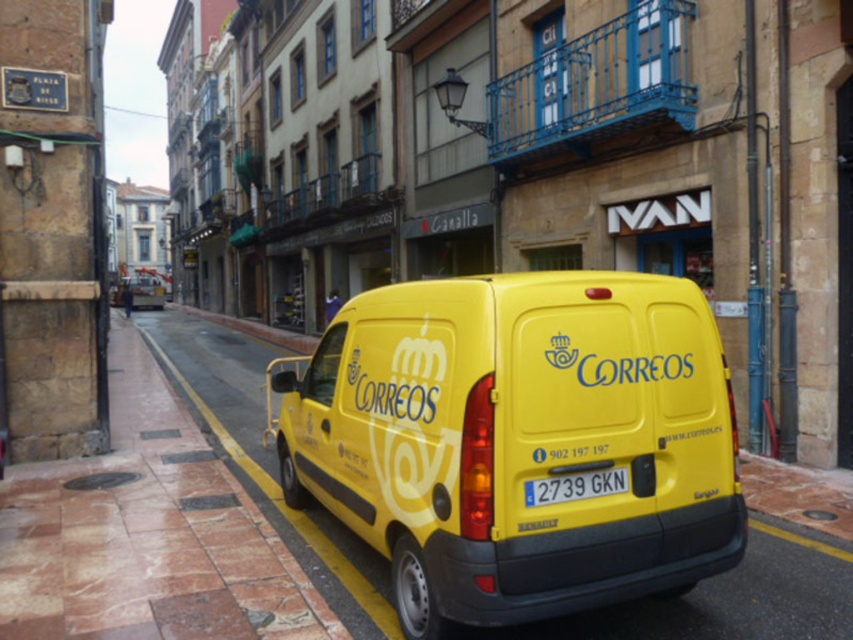
Who is taller, yellow matte van at center or yellow painted curb at lower left?

yellow matte van at center is taller.

Is yellow matte van at center taller than yellow painted curb at lower left?

Correct, yellow matte van at center is much taller as yellow painted curb at lower left.

Between point (683, 364) and point (328, 557), which one is positioned behind?

The point (328, 557) is behind.

Locate an element on the screen. yellow matte van at center is located at coordinates (518, 440).

Who is shorter, yellow painted curb at lower left or yellow plastic license plate at center?

With less height is yellow plastic license plate at center.

Is yellow painted curb at lower left positioned in front of yellow plastic license plate at center?

No, yellow painted curb at lower left is behind yellow plastic license plate at center.

Does point (227, 432) come closer to viewer compared to point (556, 497)?

That is False.

You are a GUI agent. You are given a task and a screenshot of the screen. Output one action in this format:
    pyautogui.click(x=<x>, y=<y>)
    Task: Click on the yellow painted curb at lower left
    The image size is (853, 640).
    Given the screenshot: What is the action you would take?
    pyautogui.click(x=265, y=460)

Is point (569, 337) closer to viewer compared to point (619, 476)?

Yes.

Between yellow matte van at center and yellow plastic license plate at center, which one appears on the right side from the viewer's perspective?

From the viewer's perspective, yellow plastic license plate at center appears more on the right side.

Identify the location of yellow matte van at center. This screenshot has width=853, height=640. (518, 440).